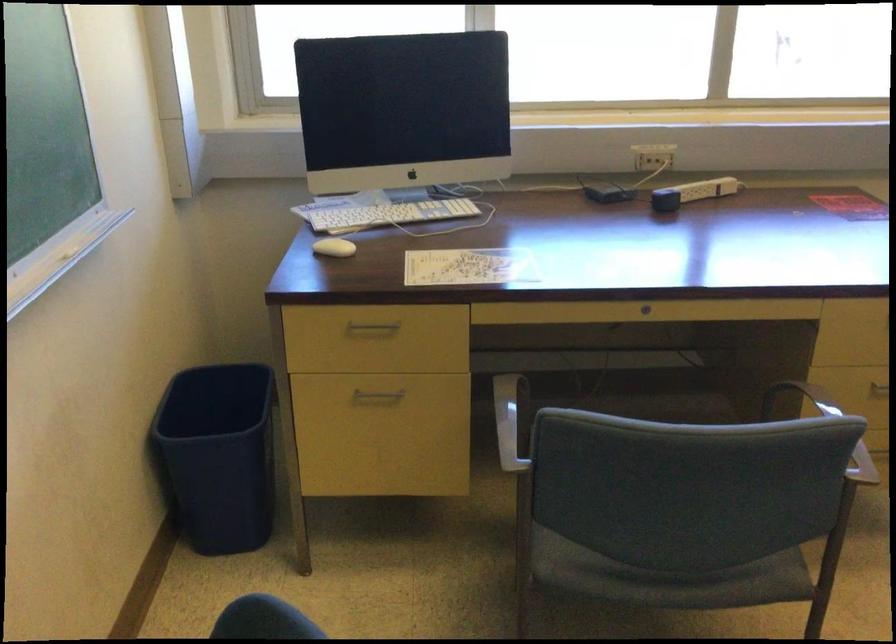
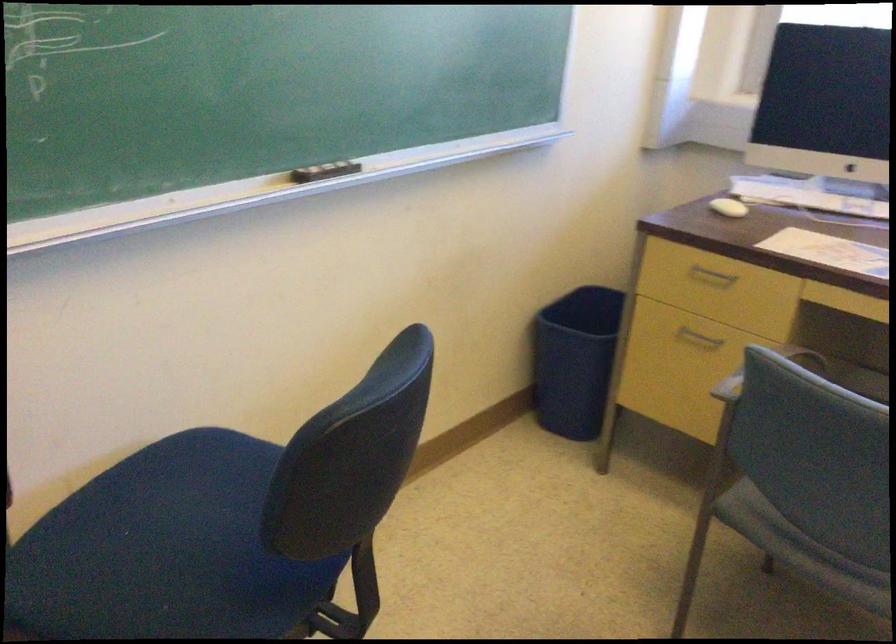
Question: The images are taken continuously from a first-person perspective. In which direction is your viewpoint rotating?

Choices:
 (A) Left
 (B) Right
 (C) Up
 (D) Down

Answer: (A)